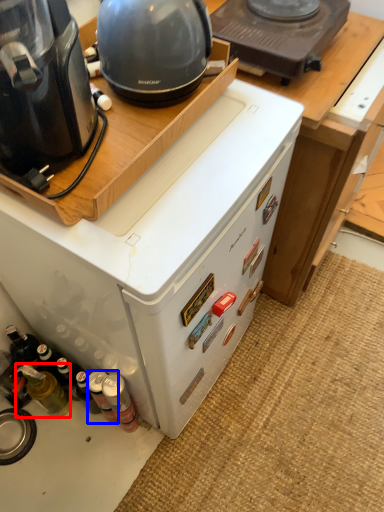
Question: Which point is further to the camera, bottle (highlighted by a red box) or bottle (highlighted by a blue box)?

Choices:
 (A) bottle
 (B) bottle

Answer: (B)